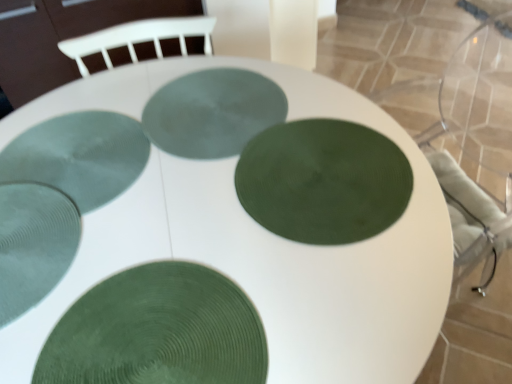
Locate an element on the screen. The image size is (512, 384). free space between green textured glass plate at center, which is the 1th glass plate in back-to-front order, and green textured glass plate at center, arranged as the fourth glass plate when viewed from the front is located at coordinates (164, 158).